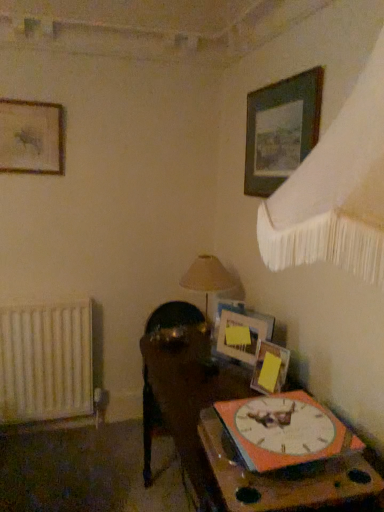
Question: In terms of width, does beige fabric lampshade at center look wider or thinner when compared to orange matte wall clock at lower right?

Choices:
 (A) thin
 (B) wide

Answer: (A)

Question: From the image's perspective, is beige fabric lampshade at center positioned above or below orange matte wall clock at lower right?

Choices:
 (A) above
 (B) below

Answer: (A)

Question: Which is farther from the wooden picture frame at upper right, which is the fourth picture frame from left to right?

Choices:
 (A) wooden picture frame at upper left, the fourth picture frame from the bottom
 (B) orange matte wall clock at lower right
 (C) wooden picture frame at center, which is the 4th picture frame from top to bottom
 (D) white matte radiator at left
 (E) matte wooden picture frame at upper right, the 2th picture frame in the bottom-to-top sequence

Answer: (D)

Question: Which of these objects is positioned farthest from the wooden picture frame at center, which is counted as the 3th picture frame, starting from the left?

Choices:
 (A) wooden clock at lower right, acting as the 2th table starting from the bottom
 (B) beige fabric lampshade at center
 (C) wooden picture frame at upper right, which is the fourth picture frame from left to right
 (D) orange matte wall clock at lower right
 (E) matte wooden picture frame at upper right, which ranks as the 3th picture frame in right-to-left order

Answer: (C)